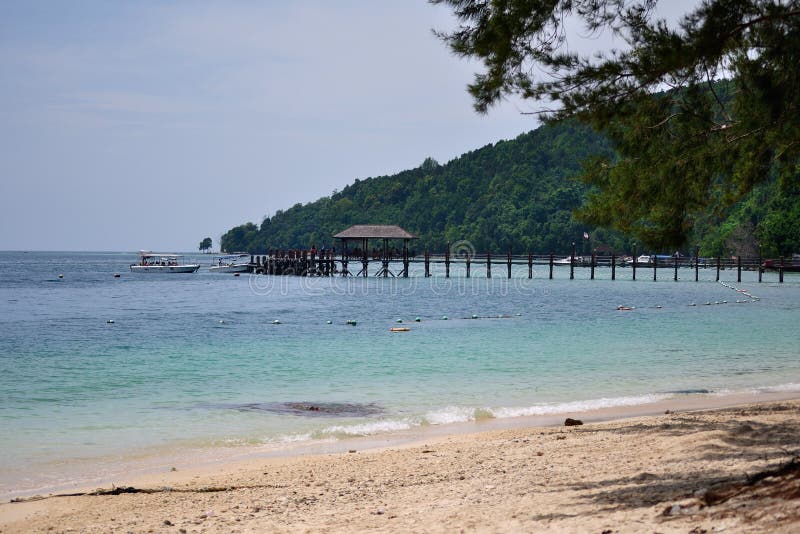
Identify the location of cover. (378, 229).